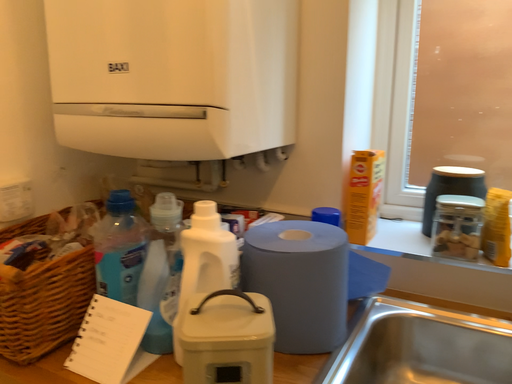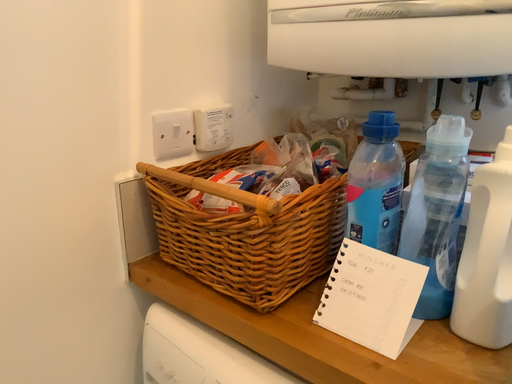
Question: How did the camera likely rotate when shooting the video?

Choices:
 (A) rotated left
 (B) rotated right

Answer: (A)